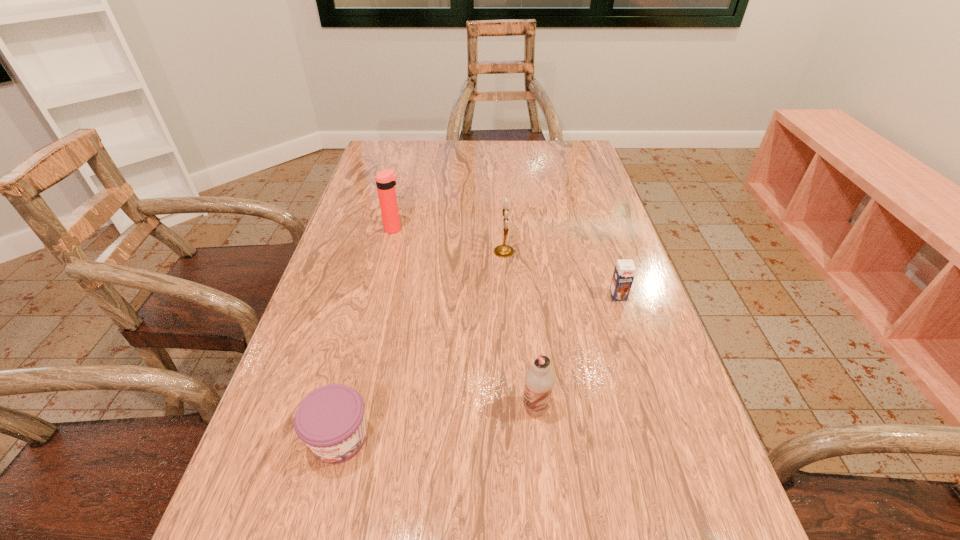
Identify the location of vacant space located on the front label of the rightmost object. (645, 380).

Identify the location of thermos bottle that is positioned at the left edge. The width and height of the screenshot is (960, 540). (386, 180).

Find the location of a particular element. This screenshot has height=540, width=960. jam that is at the left edge is located at coordinates (330, 420).

Locate an element on the screen. Image resolution: width=960 pixels, height=540 pixels. object located in the right edge section of the desktop is located at coordinates (625, 270).

The height and width of the screenshot is (540, 960). Identify the location of vacant space at the far edge of the desktop. (420, 173).

In the image, there is a desktop. At what (x,y) coordinates should I click in order to perform the action: click on free region at the left edge. Please return your answer as a coordinate pair (x, y). The height and width of the screenshot is (540, 960). Looking at the image, I should click on (405, 205).

In the image, there is a desktop. What are the coordinates of `vacant space at the right edge` in the screenshot? It's located at (621, 240).

Image resolution: width=960 pixels, height=540 pixels. What are the coordinates of `vacant region between the jam and the nearer chocolate milk` in the screenshot? It's located at (438, 423).

Find the location of `empty location between the fourth nearest object and the third tallest object`. empty location between the fourth nearest object and the third tallest object is located at coordinates (519, 329).

This screenshot has height=540, width=960. Find the location of `free space that is in between the taller chocolate milk and the thermos bottle`. free space that is in between the taller chocolate milk and the thermos bottle is located at coordinates (465, 318).